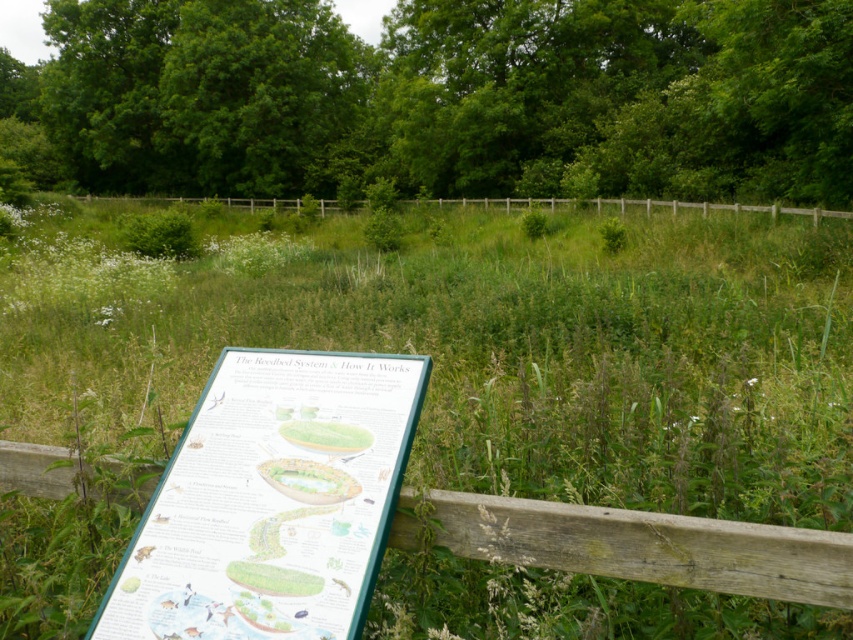
Question: Can you confirm if green leafy tree at center is positioned to the left of green plastic sign at center?

Choices:
 (A) no
 (B) yes

Answer: (B)

Question: Estimate the real-world distances between objects in this image. Which object is closer to the green grassy at center?

Choices:
 (A) green plastic sign at center
 (B) green leafy tree at upper left
 (C) wooden at center

Answer: (A)

Question: Which object is closer to the camera taking this photo?

Choices:
 (A) wooden at center
 (B) green leafy tree at upper left
 (C) wooden fence at center
 (D) green plastic sign at center

Answer: (A)

Question: In this image, where is green grassy at center located relative to wooden fence at center?

Choices:
 (A) below
 (B) above

Answer: (A)

Question: Does green grassy at center have a smaller size compared to green leafy tree at upper left?

Choices:
 (A) yes
 (B) no

Answer: (B)

Question: Which of the following is the closest to the observer?

Choices:
 (A) green grassy at center
 (B) wooden at center

Answer: (B)